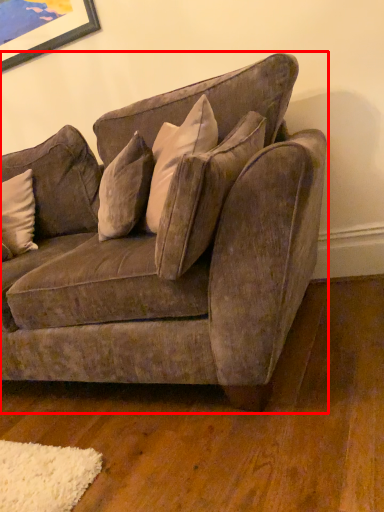
Question: From the image, what is the correct spatial relationship of studio couch (annotated by the red box) in relation to pillow?

Choices:
 (A) right
 (B) left

Answer: (A)